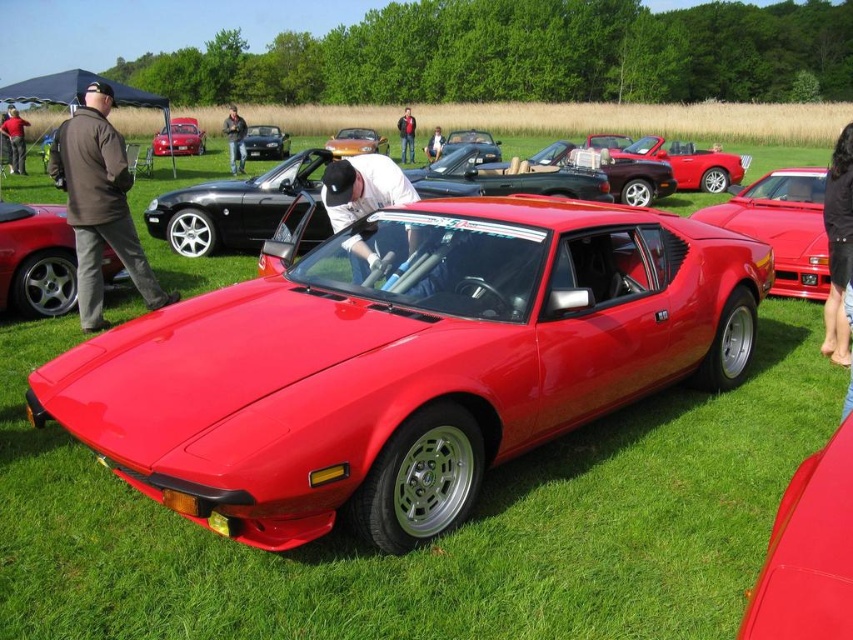
The width and height of the screenshot is (853, 640). I want to click on shiny red sports car at center, so click(405, 364).

Is shiny red sports car at center positioned before metallic orange convertible at center?

Yes, shiny red sports car at center is in front of metallic orange convertible at center.

Which is in front, point (669, 221) or point (363, 150)?

Positioned in front is point (669, 221).

Find the location of a particular element. This screenshot has height=640, width=853. shiny red sports car at center is located at coordinates pyautogui.click(x=405, y=364).

Who is lower down, shiny red sports car at center or shiny red convertible at center?

shiny red sports car at center

Between point (109, 444) and point (722, 163), which one is positioned in front?

Point (109, 444)

Locate an element on the screen. shiny red sports car at center is located at coordinates (405, 364).

Which is more to the right, shiny red convertible at center or dark brown leather jacket at left?

shiny red convertible at center

You are a GUI agent. You are given a task and a screenshot of the screen. Output one action in this format:
    pyautogui.click(x=<x>, y=<y>)
    Task: Click on the shiny red convertible at center
    Image resolution: width=853 pixels, height=640 pixels.
    Given the screenshot: What is the action you would take?
    pyautogui.click(x=689, y=163)

You are a GUI agent. You are given a task and a screenshot of the screen. Output one action in this format:
    pyautogui.click(x=<x>, y=<y>)
    Task: Click on the shiny red convertible at center
    
    Given the screenshot: What is the action you would take?
    pyautogui.click(x=689, y=163)